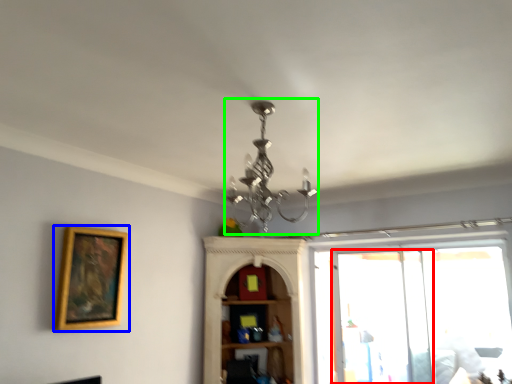
Question: Estimate the real-world distances between objects in this image. Which object is closer to screen door (highlighted by a red box), picture frame (highlighted by a blue box) or light fixture (highlighted by a green box)?

Choices:
 (A) picture frame
 (B) light fixture

Answer: (B)